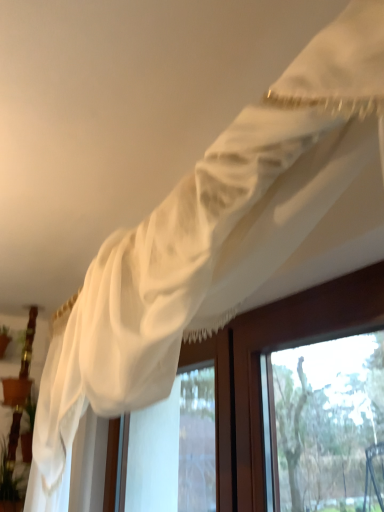
Locate an element on the screen. The height and width of the screenshot is (512, 384). translucent fabric at upper center is located at coordinates (258, 369).

What do you see at coordinates (258, 369) in the screenshot?
I see `translucent fabric at upper center` at bounding box center [258, 369].

What is the approximate width of translucent fabric at upper center?

translucent fabric at upper center is 5.01 inches in width.

Find the location of `translucent fabric at upper center`. translucent fabric at upper center is located at coordinates (258, 369).